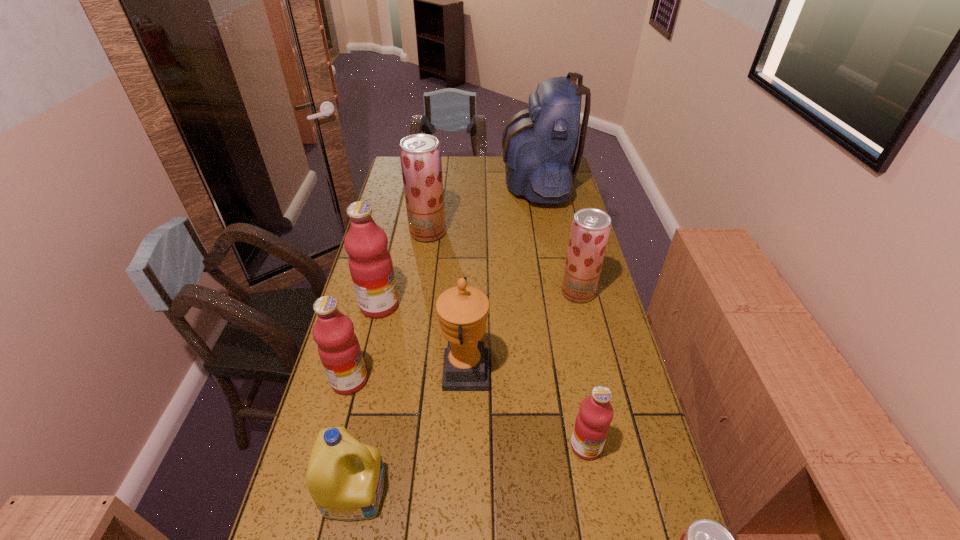
You are a GUI agent. You are given a task and a screenshot of the screen. Output one action in this format:
    pyautogui.click(x=<x>, y=<y>)
    Task: Click on the free space that is in between the detergent and the rightmost pink fruit juice
    Image resolution: width=960 pixels, height=540 pixels.
    Given the screenshot: What is the action you would take?
    pyautogui.click(x=470, y=468)

In order to click on free space between the second nearest fruit juice and the golden award in this screenshot , I will do `click(525, 409)`.

At what (x,y) coordinates should I click in order to perform the action: click on free spot between the second biggest strawberry fruit juice and the fifth object from left to right. Please return your answer as a coordinate pair (x, y). Looking at the image, I should click on (521, 332).

At what (x,y) coordinates should I click in order to perform the action: click on vacant point located between the eighth nearest object and the biggest pink fruit juice. Please return your answer as a coordinate pair (x, y). This screenshot has height=540, width=960. Looking at the image, I should click on (403, 269).

Where is `free area in between the farthest fruit juice and the tallest object`? This screenshot has width=960, height=540. free area in between the farthest fruit juice and the tallest object is located at coordinates (482, 208).

You are a GUI agent. You are given a task and a screenshot of the screen. Output one action in this format:
    pyautogui.click(x=<x>, y=<y>)
    Task: Click on the vacant area that lies between the blue backpack and the award
    
    Given the screenshot: What is the action you would take?
    pyautogui.click(x=501, y=278)

Locate which object ranks seventh in proximity to the farthest object. Please provide its 2D coordinates. Your answer should be formatted as a tuple, i.e. [(x, y)], where the tuple contains the x and y coordinates of a point satisfying the conditions above.

[(345, 478)]

Select which object appears as the second closest to the fifth object from right to left. Please provide its 2D coordinates. Your answer should be formatted as a tuple, i.e. [(x, y)], where the tuple contains the x and y coordinates of a point satisfying the conditions above.

[(345, 478)]

I want to click on fruit juice identified as the fourth closest to the fifth object from left to right, so click(x=590, y=228).

At what (x,y) coordinates should I click in order to perform the action: click on fruit juice that is the fourth closest one to the second biggest strawberry fruit juice. Please return your answer as a coordinate pair (x, y). This screenshot has width=960, height=540. Looking at the image, I should click on (339, 350).